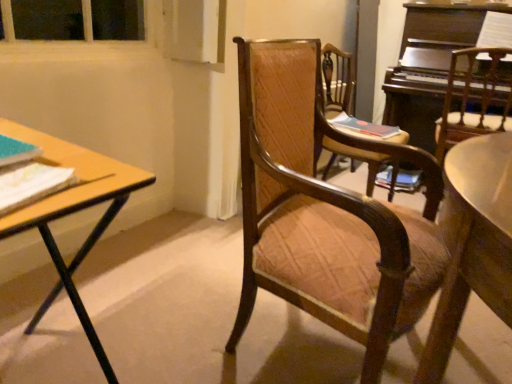
The height and width of the screenshot is (384, 512). I want to click on vacant space to the right of white paper at left, the 1th book in the front-to-back sequence, so click(x=71, y=203).